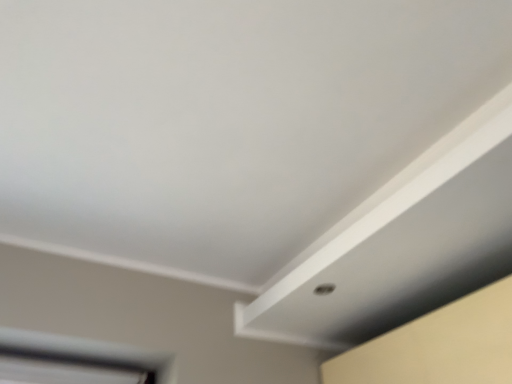
Question: Is white matte exhaust hood at center to the left or to the right of white plastic window at lower left in the image?

Choices:
 (A) left
 (B) right

Answer: (B)

Question: Is white matte exhaust hood at center inside or outside of white plastic window at lower left?

Choices:
 (A) inside
 (B) outside

Answer: (B)

Question: Considering the positions of point (476, 263) and point (132, 372), is point (476, 263) closer or farther from the camera than point (132, 372)?

Choices:
 (A) farther
 (B) closer

Answer: (B)

Question: Is white plastic window at lower left inside the boundaries of white matte exhaust hood at center, or outside?

Choices:
 (A) inside
 (B) outside

Answer: (B)

Question: Looking at their shapes, would you say white plastic window at lower left is wider or thinner than white matte exhaust hood at center?

Choices:
 (A) thin
 (B) wide

Answer: (A)

Question: From a real-world perspective, is white plastic window at lower left above or below white matte exhaust hood at center?

Choices:
 (A) above
 (B) below

Answer: (B)

Question: In terms of size, does white plastic window at lower left appear bigger or smaller than white matte exhaust hood at center?

Choices:
 (A) big
 (B) small

Answer: (B)